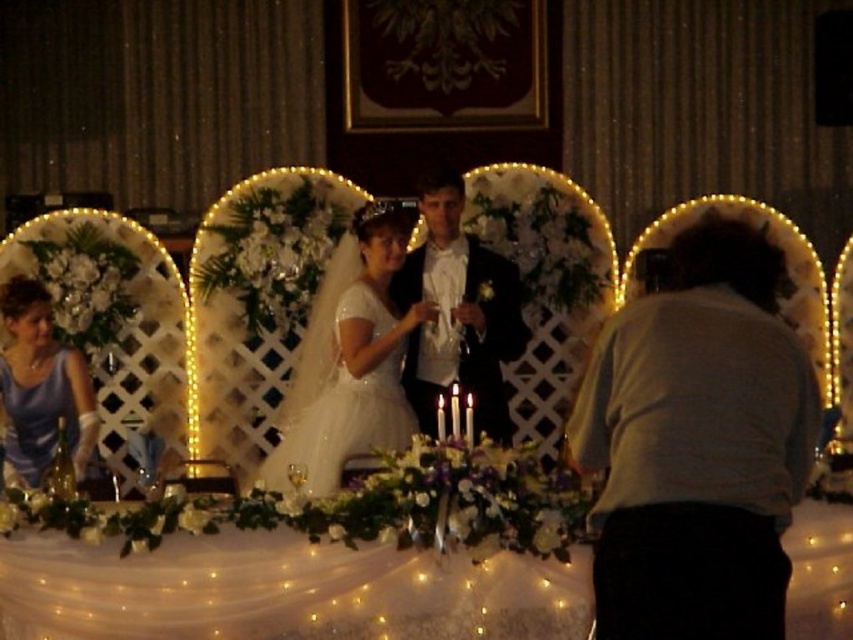
Which is above, white lace tablecloth at lower center or matte blue dress at left?

matte blue dress at left is higher up.

Does point (167, 636) come behind point (27, 333)?

No, (167, 636) is in front of (27, 333).

Locate an element on the screen. The image size is (853, 640). white lace tablecloth at lower center is located at coordinates (283, 589).

Is gray cotton shirt at right positioned at the back of shiny black suit at center?

No, gray cotton shirt at right is in front of shiny black suit at center.

Between point (682, 273) and point (466, 236), which one is positioned behind?

The point (466, 236) is more distant.

Between point (735, 461) and point (430, 221), which one is positioned in front?

Point (735, 461) is more forward.

Where is `gray cotton shirt at right`? gray cotton shirt at right is located at coordinates (697, 444).

Can you confirm if white satin dress at center is positioned above shiny black suit at center?

No, white satin dress at center is not above shiny black suit at center.

Which is above, white satin dress at center or shiny black suit at center?

shiny black suit at center

Does point (347, 388) lie in front of point (415, 396)?

That is True.

Locate an element on the screen. This screenshot has height=640, width=853. white satin dress at center is located at coordinates (349, 364).